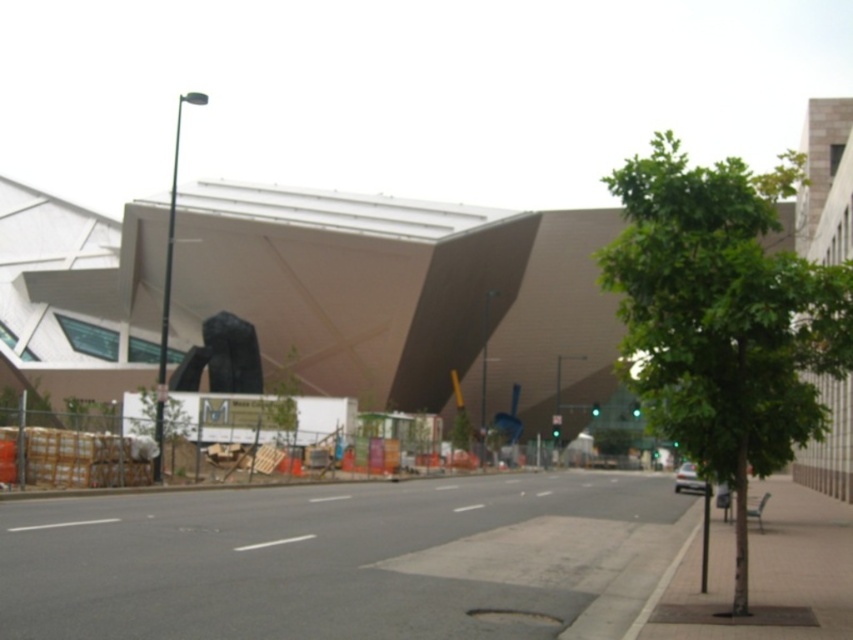
You are a city planner reviewing the urban street scene. The construction site requires placing a new temporary structure that must be at least 2 meters away from the smooth concrete building at center. Given the coordinates of the building, can you confirm if the proposed location at point A, which is at coordinates 0.5 meters away in the x and y directions, meets the safety requirement?

The smooth concrete building at center is located at point (x=403, y=296). The proposed location at point A is 0.5 meters away in both x and y directions. The distance between them would be sqrt 0.5 squared plus 0.5 squared equals approximately 0.707 meters, which is less than the required 2 meters. Therefore, the proposed location does not meet the safety requirement.

You are a city planner evaluating the urban space. The smooth concrete building at center and the green leafy tree at right are both in the construction zone. Based on their widths, which one occupies more horizontal space in the scene?

The smooth concrete building at center is wider than the green leafy tree at right, so it occupies more horizontal space in the scene.

You are a city planner reviewing this urban area. You need to determine the spatial relationship between the smooth concrete building at center and the green leafy tree at right. Based on the image, which object is positioned to the left of the other?

The smooth concrete building at center is to the left of the green leafy tree at right according to the description.